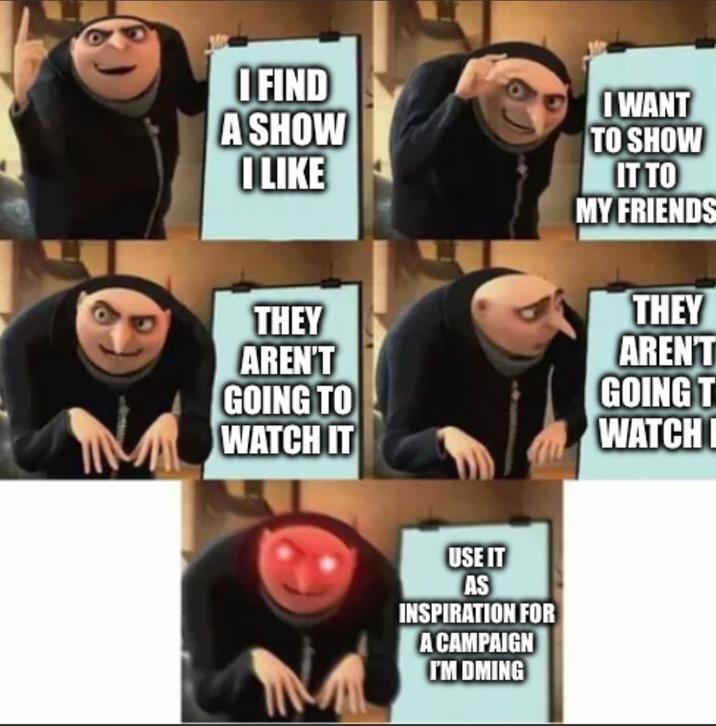
Where is `white board`? The width and height of the screenshot is (716, 726). white board is located at coordinates (669, 62), (339, 303), (614, 329), (528, 578).